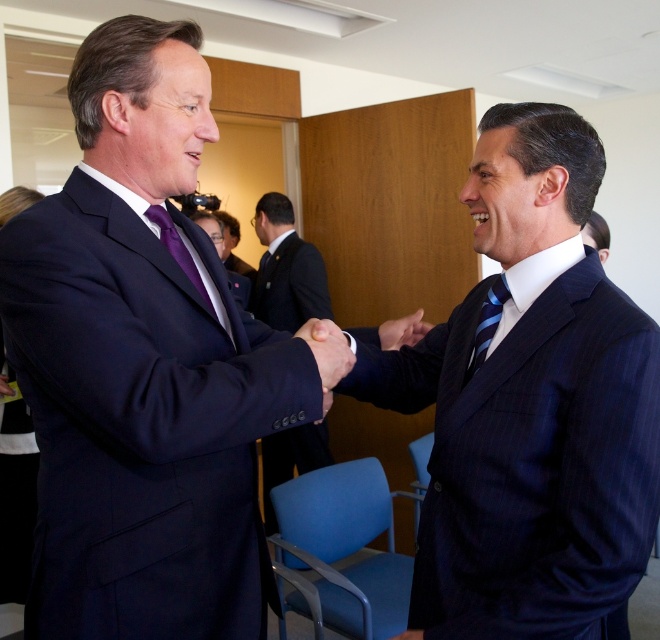
You are a photographer at this event. You want to take a photo where the purple silk tie at left is framed to be larger than the matte black hand at center. Which object should you move closer to the camera?

To make the purple silk tie at left appear larger than the matte black hand at center in the photo, you should move the purple silk tie at left closer to the camera. Since the purple silk tie at left is currently smaller than the matte black hand at center, bringing it nearer will increase its apparent size relative to the hand.

You are a photographer at the event and need to position a spotlight exactly at point (x=286, y=269). What object should you expect to illuminate there?

The dark blue suit at center is located at point (x=286, y=269), so the spotlight will illuminate the dark blue suit at center.

You are a photographer at this event and want to capture a photo of the dark blue suit at center and the smooth skin handshake at center in the same frame. Your camera has a maximum focus range of 2 meters. Will you be able to include both in the shot?

The dark blue suit at center and smooth skin handshake at center are 2.19 meters apart from each other, which exceeds the camera maximum focus range of 2 meters. Therefore, you cannot include both in the same frame.